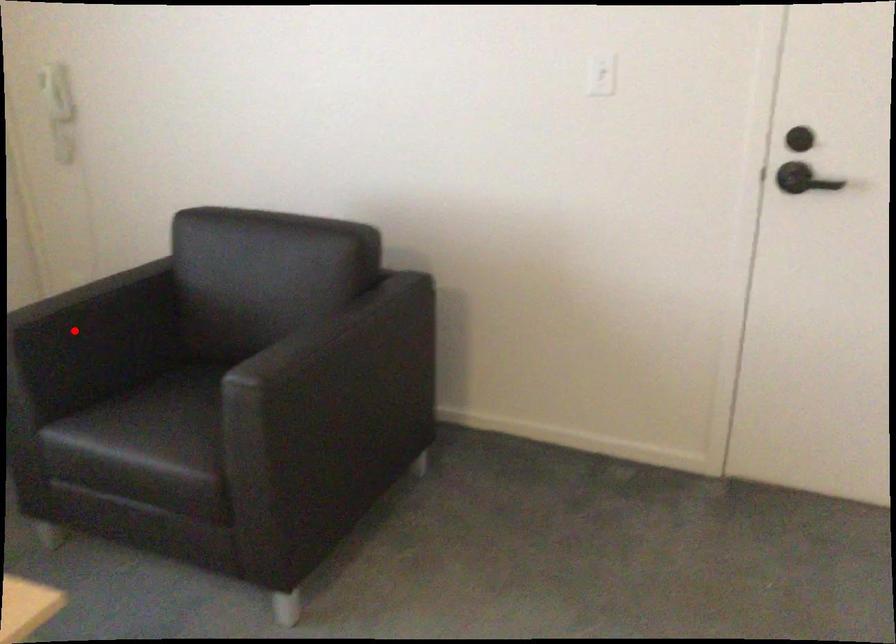
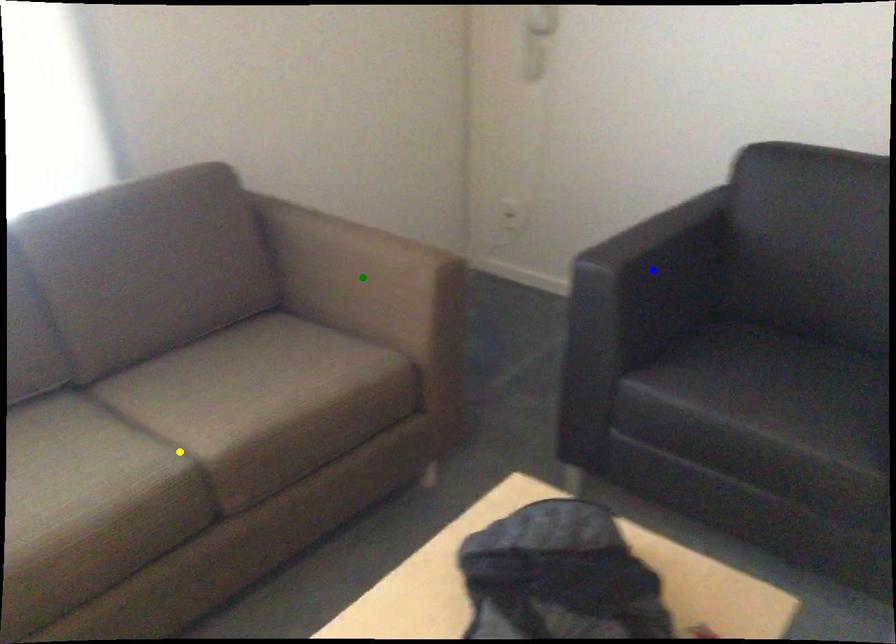
Question: I am providing you with two images of the same scene from different viewpoints. A red point is marked on the first image. You are given multiple points on the second image. Can you choose the point in image 2 that corresponds to the point in image 1?

Choices:
 (A) blue point
 (B) green point
 (C) yellow point

Answer: (A)